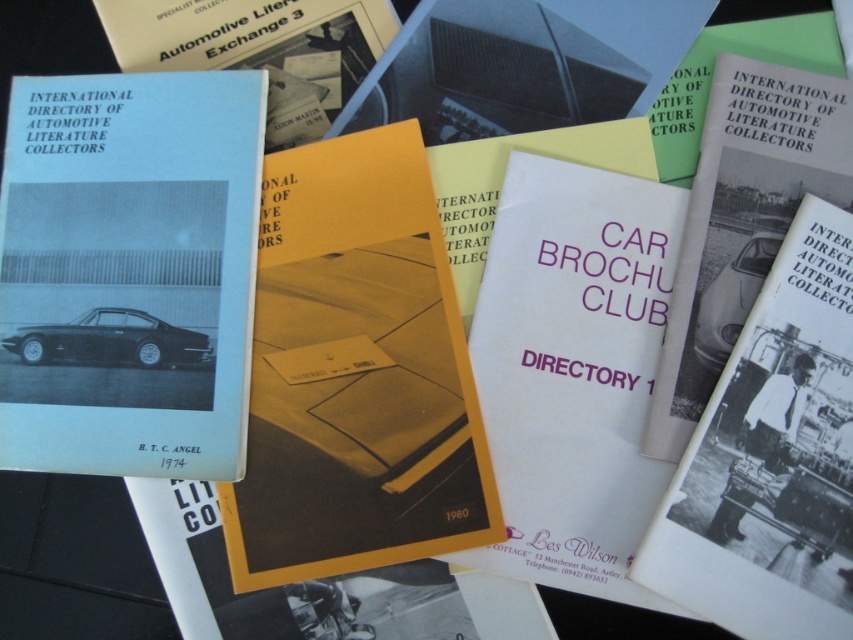
Question: Among these objects, which one is nearest to the camera?

Choices:
 (A) white paper directory at center
 (B) white glossy car at center
 (C) matte black book at left
 (D) black matte car at center

Answer: (A)

Question: Does matte black book at left appear over black matte car at center?

Choices:
 (A) no
 (B) yes

Answer: (B)

Question: Does yellow paper brochure at center appear on the right side of black matte car at center?

Choices:
 (A) no
 (B) yes

Answer: (B)

Question: Which of these objects is positioned closest to the matte black book at left?

Choices:
 (A) matte blue booklet at upper left
 (B) white paper directory at center
 (C) yellow paper brochure at center

Answer: (C)

Question: Among these points, which one is farthest from the camera?

Choices:
 (A) pos(78,189)
 (B) pos(274,147)

Answer: (B)

Question: Can you confirm if white paper directory at center is positioned to the right of white glossy car at center?

Choices:
 (A) no
 (B) yes

Answer: (B)